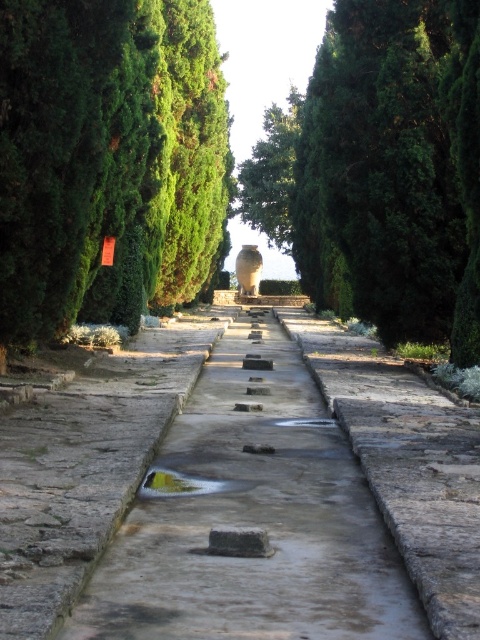
Question: Does green leafy tree at left have a greater width compared to green leafy tree at center?

Choices:
 (A) no
 (B) yes

Answer: (A)

Question: Which object is the closest to the gray stone steps at center?

Choices:
 (A) green leafy tree at center
 (B) green leafy tree at left
 (C) green textured stone at center

Answer: (B)

Question: Is gray stone steps at center above green leafy tree at center?

Choices:
 (A) no
 (B) yes

Answer: (A)

Question: Does gray stone steps at center come in front of green textured stone at center?

Choices:
 (A) no
 (B) yes

Answer: (B)

Question: Which object appears closest to the camera in this image?

Choices:
 (A) green leafy tree at left
 (B) green leafy tree at center
 (C) gray stone steps at center
 (D) green textured stone at center

Answer: (C)

Question: Which of the following is the closest to the observer?

Choices:
 (A) green textured stone at center
 (B) gray stone steps at center
 (C) green leafy tree at center
 (D) green leafy tree at left

Answer: (B)